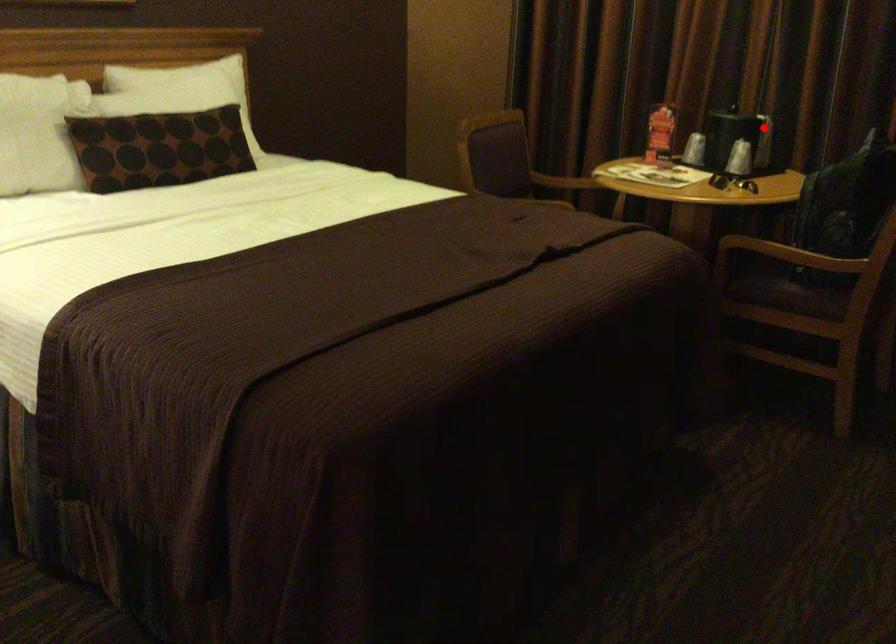
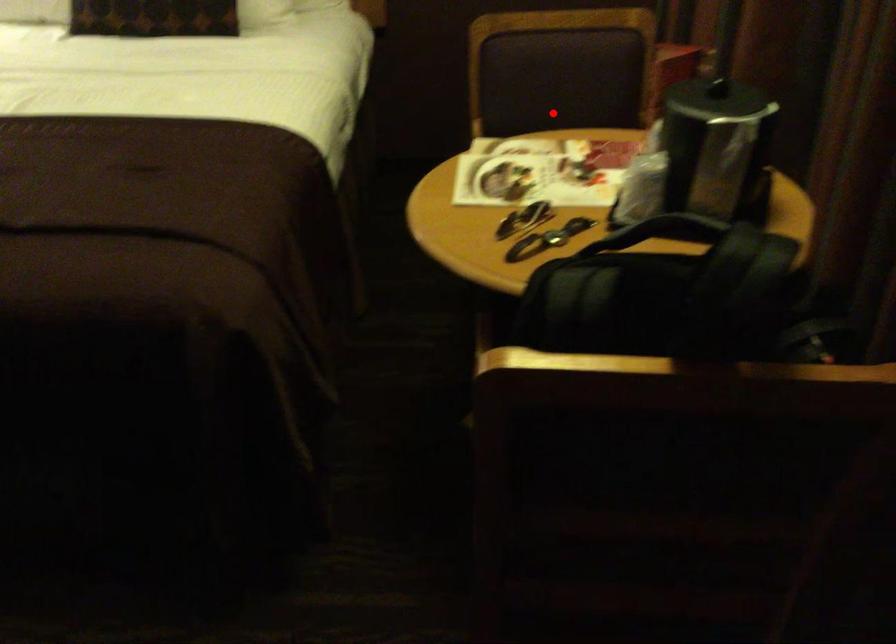
I am providing you with two images of the same scene from different viewpoints. A red point is marked on the first image and another point is marked on the second image. Do the highlighted points in image1 and image2 indicate the same real-world spot?

No